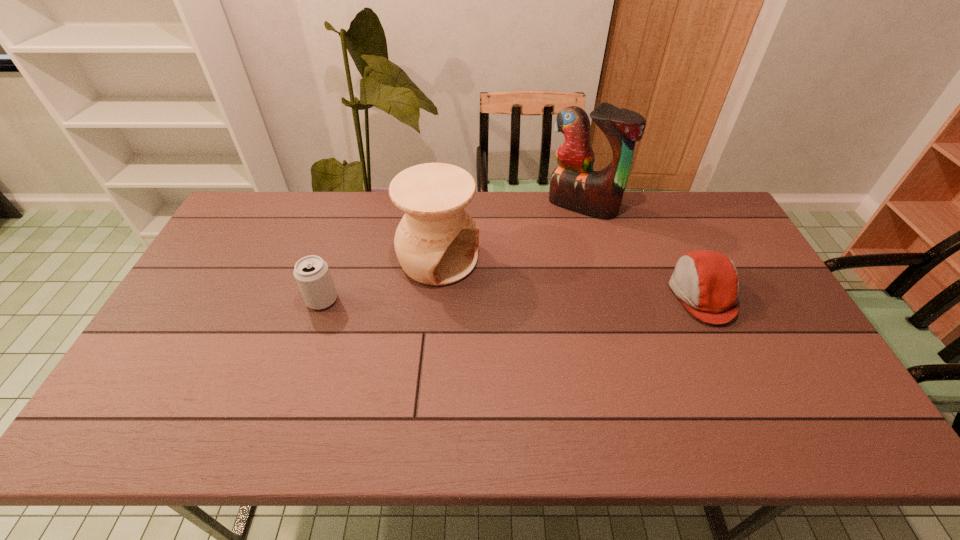
This screenshot has height=540, width=960. What are the coordinates of `vacant space that satisfies the following two spatial constraints: 1. on the front side of the cap; 2. on the front-facing side of the tallest object` in the screenshot? It's located at (607, 294).

Find the location of a particular element. This screenshot has height=540, width=960. vacant region that satisfies the following two spatial constraints: 1. on the front side of the rightmost object; 2. on the front-facing side of the third object from left to right is located at coordinates (607, 294).